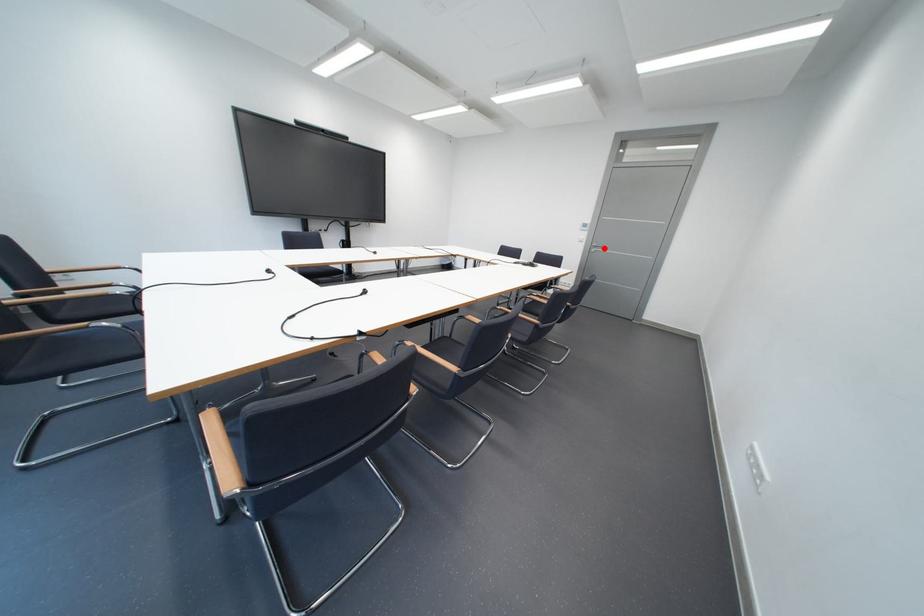
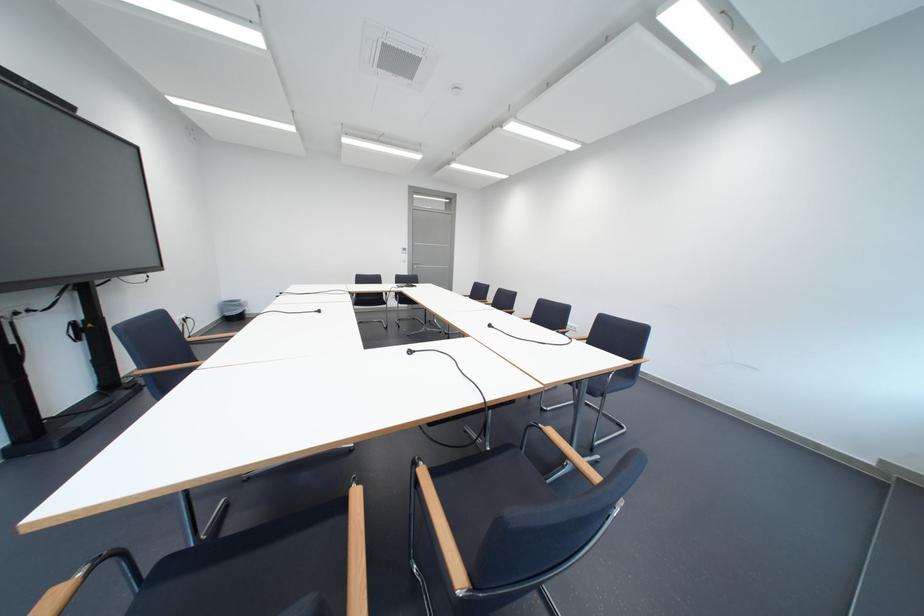
Question: I am providing you with two images of the same scene from different viewpoints. A red point is marked on the first image. At the location where the point appears in image 1, is it still visible in image 2?

Choices:
 (A) Yes
 (B) No

Answer: (A)